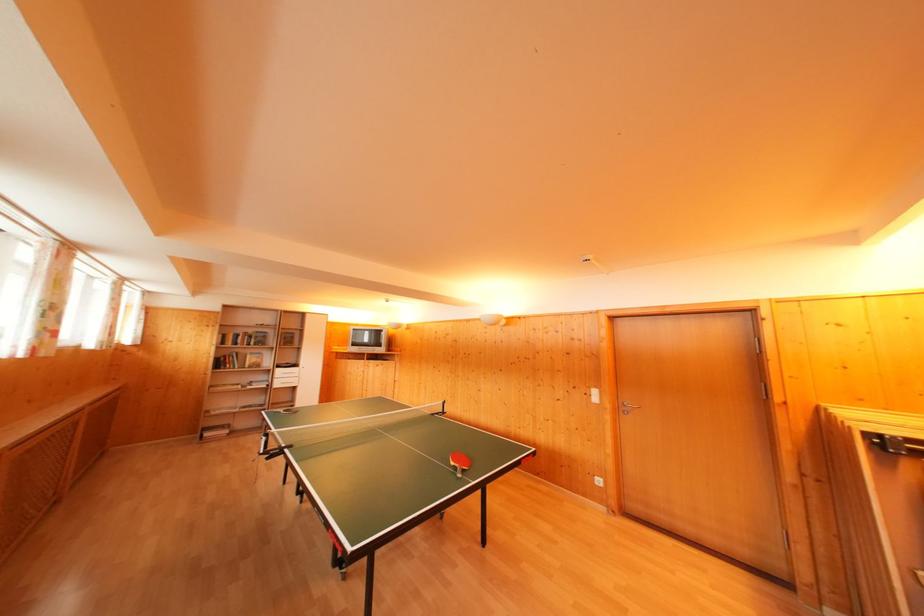
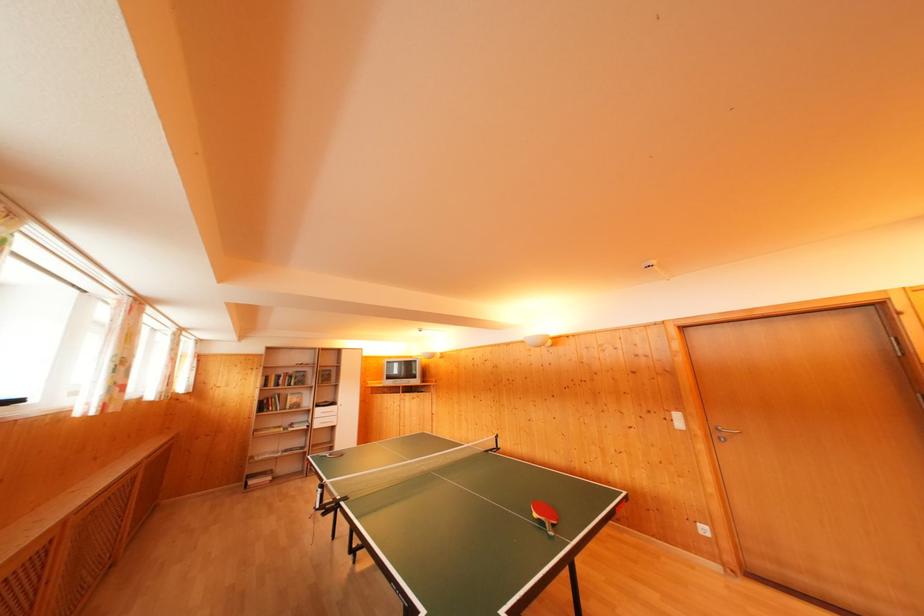
In a continuous first-person perspective shot, in which direction is the camera moving?

The cameraman walked toward left, forward.